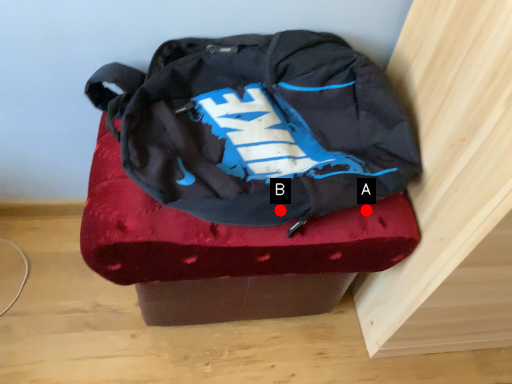
Question: Two points are circled on the image, labeled by A and B beside each circle. Which point appears closest to the camera in this image?

Choices:
 (A) A is closer
 (B) B is closer

Answer: (B)